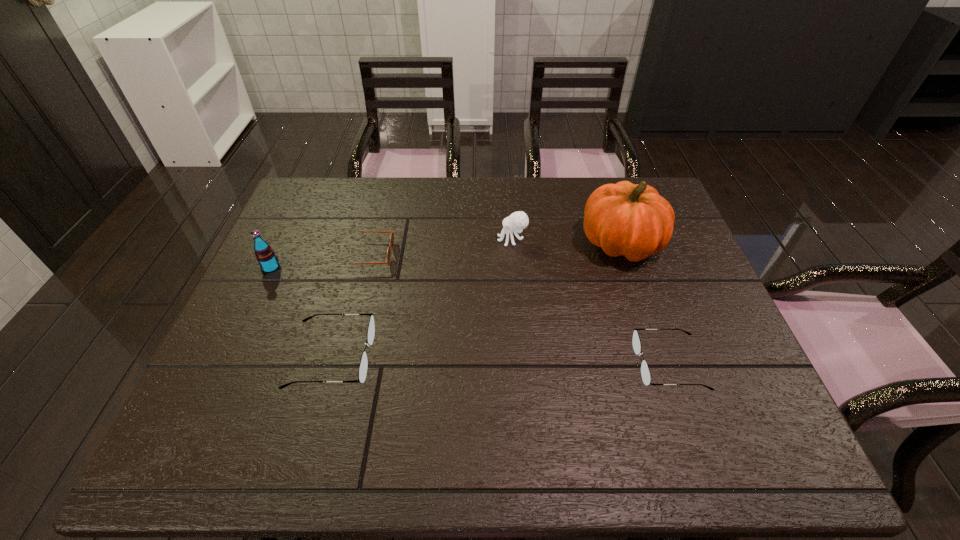
I want to click on the taller spectacles, so click(x=362, y=373).

You are a GUI agent. You are given a task and a screenshot of the screen. Output one action in this format:
    pyautogui.click(x=<x>, y=<y>)
    Task: Click on the left spectacles
    
    Given the screenshot: What is the action you would take?
    pyautogui.click(x=362, y=373)

Locate an element on the screen. This screenshot has height=540, width=960. the right spectacles is located at coordinates (645, 372).

Identify the location of the third tallest object. (518, 220).

Find the location of `the fourth object from left to right`. the fourth object from left to right is located at coordinates (518, 220).

At what (x,y) coordinates should I click in order to perform the action: click on the second tallest object. Please return your answer as a coordinate pair (x, y). The width and height of the screenshot is (960, 540). Looking at the image, I should click on (265, 255).

Find the location of `the leftmost object`. the leftmost object is located at coordinates (265, 255).

Image resolution: width=960 pixels, height=540 pixels. Find the location of `sunglasses`. sunglasses is located at coordinates (388, 256).

At what (x,y) coordinates should I click in order to perform the action: click on the tallest object. Please return your answer as a coordinate pair (x, y). This screenshot has width=960, height=540. Looking at the image, I should click on (625, 219).

Locate an element on the screen. The width and height of the screenshot is (960, 540). free space located 0.060m on the lenses of the fourth tallest object is located at coordinates (397, 357).